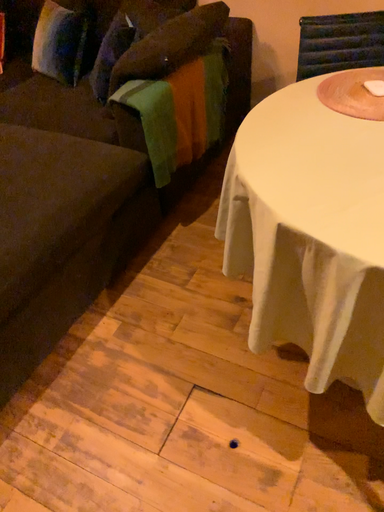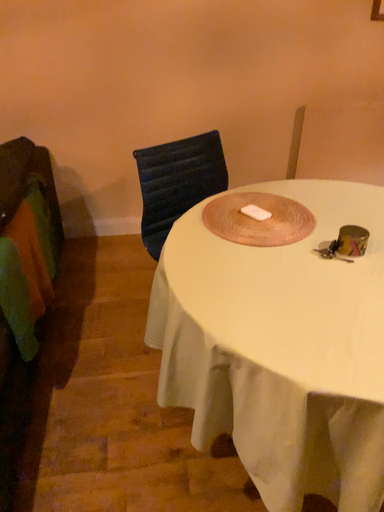
Question: How did the camera likely rotate when shooting the video?

Choices:
 (A) rotated upward
 (B) rotated downward

Answer: (A)